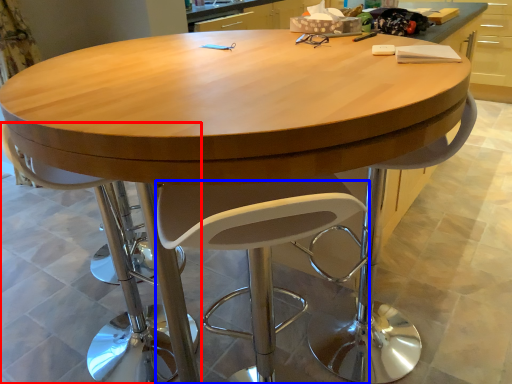
Question: Which object appears closest to the camera in this image, chair (highlighted by a red box) or swivel chair (highlighted by a blue box)?

Choices:
 (A) chair
 (B) swivel chair

Answer: (B)